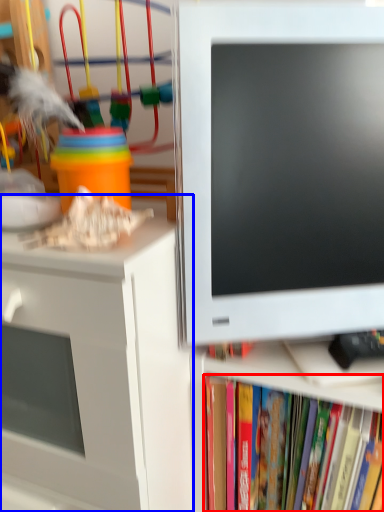
Question: Which of the following is the farthest to the observer, book (highlighted by a red box) or desk (highlighted by a blue box)?

Choices:
 (A) book
 (B) desk

Answer: (A)